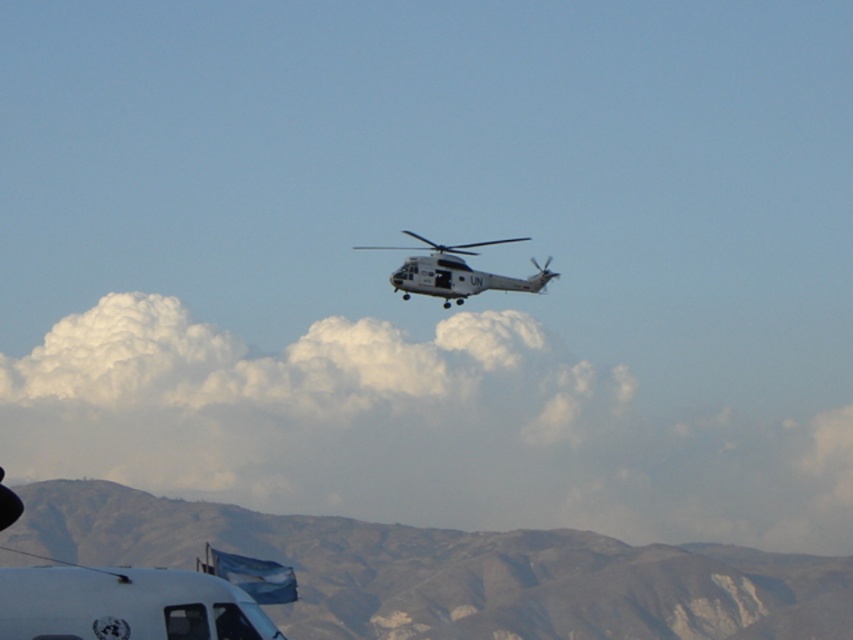
Question: In this image, where is gray rocky mountain at lower center located relative to white matte helicopter at center?

Choices:
 (A) below
 (B) above

Answer: (A)

Question: Does gray rocky mountain at lower center have a lesser width compared to white matte helicopter at center?

Choices:
 (A) no
 (B) yes

Answer: (A)

Question: Which point is farther to the camera?

Choices:
 (A) [547, 266]
 (B) [698, 605]

Answer: (B)

Question: Which object appears closest to the camera in this image?

Choices:
 (A) white matte helicopter at center
 (B) gray rocky mountain at lower center

Answer: (B)

Question: Can you confirm if gray rocky mountain at lower center is smaller than white matte helicopter at center?

Choices:
 (A) yes
 (B) no

Answer: (B)